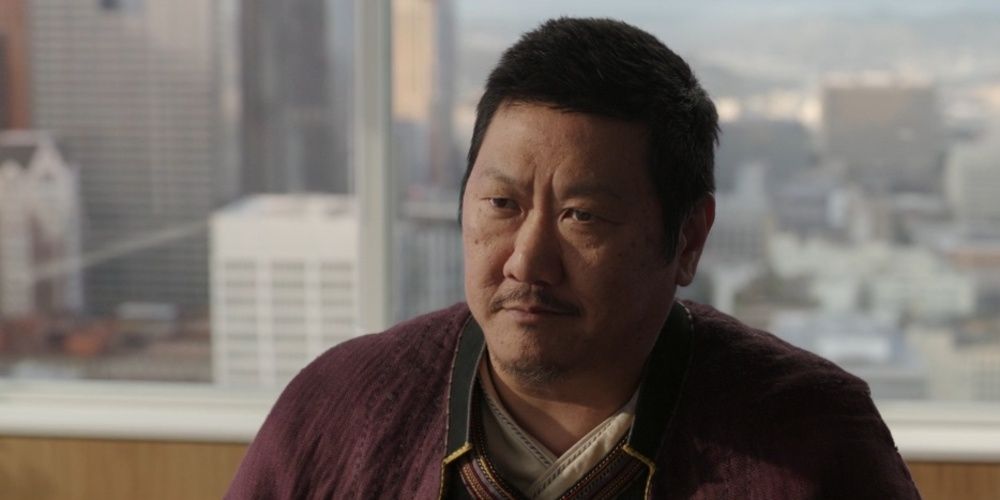
The height and width of the screenshot is (500, 1000). In order to click on wall in this screenshot , I will do `click(86, 467)`, `click(164, 466)`, `click(970, 480)`.